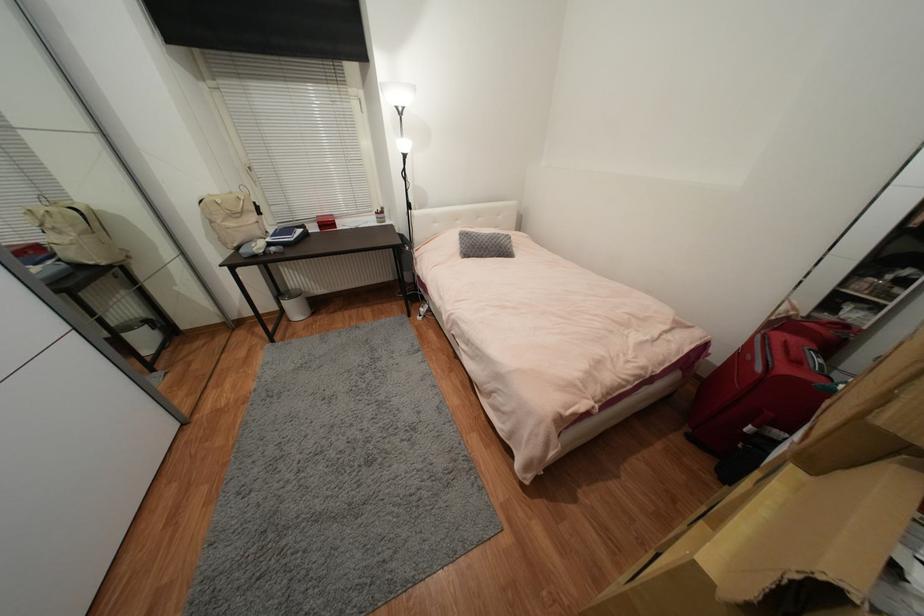
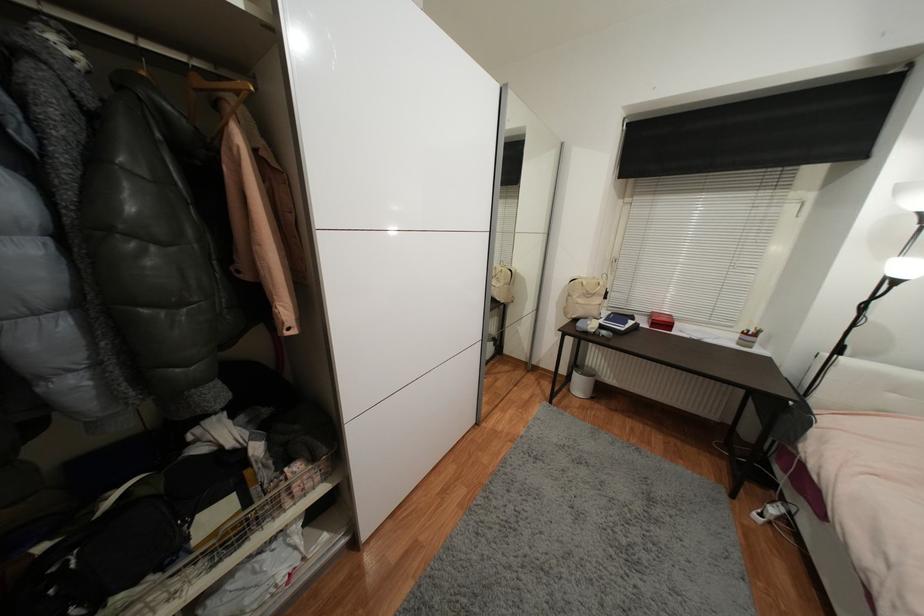
Question: The camera is either moving clockwise (left) or counter-clockwise (right) around the object. The first image is from the beginning of the video and the second image is from the end. Is the camera moving left or right when shooting the video?

Choices:
 (A) Left
 (B) Right

Answer: (B)